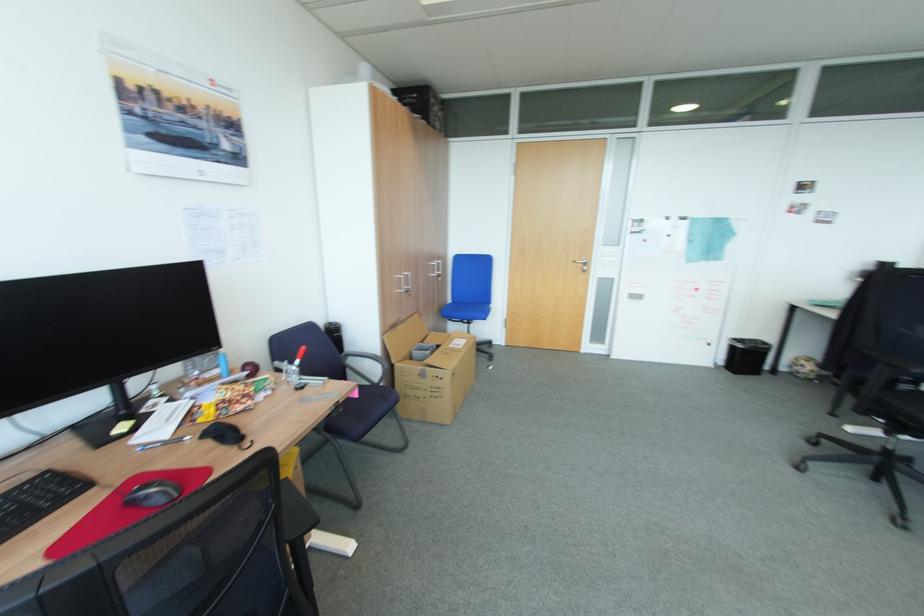
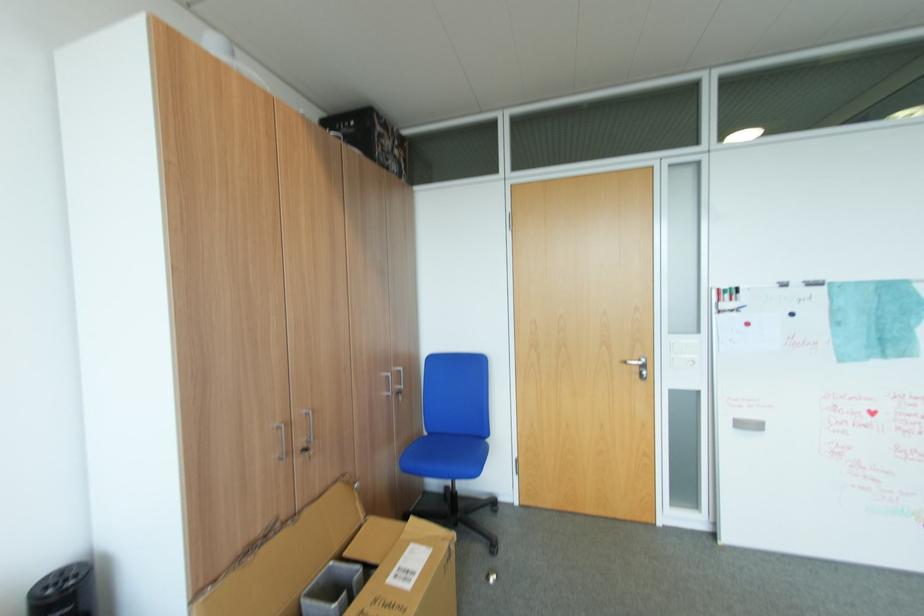
The point at (585, 270) is marked in the first image. Where is the corresponding point in the second image?

(642, 377)